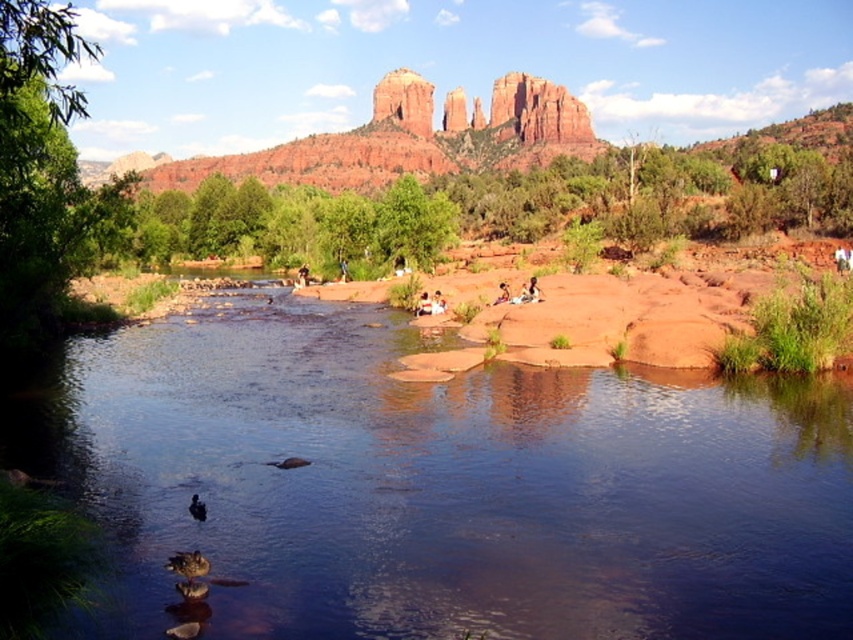
Is reddish-brown rock formation at center shorter than smooth skin person at center?

Incorrect, reddish-brown rock formation at center's height does not fall short of smooth skin person at center's.

Is point (563, 97) more distant than point (503, 300)?

Yes.

You are a GUI agent. You are given a task and a screenshot of the screen. Output one action in this format:
    pyautogui.click(x=<x>, y=<y>)
    Task: Click on the reddish-brown rock formation at center
    
    Given the screenshot: What is the action you would take?
    pyautogui.click(x=524, y=112)

Based on the photo, is clear water at center positioned before smooth skin person at center?

Yes, clear water at center is closer to the viewer.

Is point (193, 534) positioned before point (502, 291)?

Yes, point (193, 534) is in front of point (502, 291).

Which is in front, point (155, 476) or point (502, 292)?

Point (155, 476) is in front.

What are the coordinates of `clear water at center` in the screenshot? It's located at (440, 484).

Is the position of clear water at center less distant than that of reddish-brown rock formation at center?

Yes, it is in front of reddish-brown rock formation at center.

Can you confirm if clear water at center is bigger than reddish-brown rock formation at center?

Actually, clear water at center might be smaller than reddish-brown rock formation at center.

Does point (550, 547) come closer to viewer compared to point (560, 128)?

Yes, point (550, 547) is in front of point (560, 128).

I want to click on clear water at center, so click(440, 484).